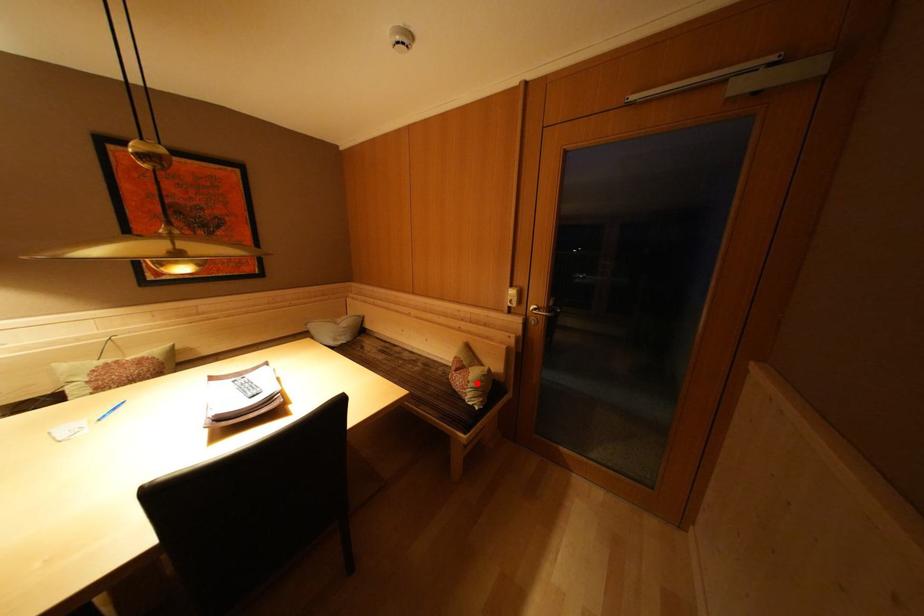
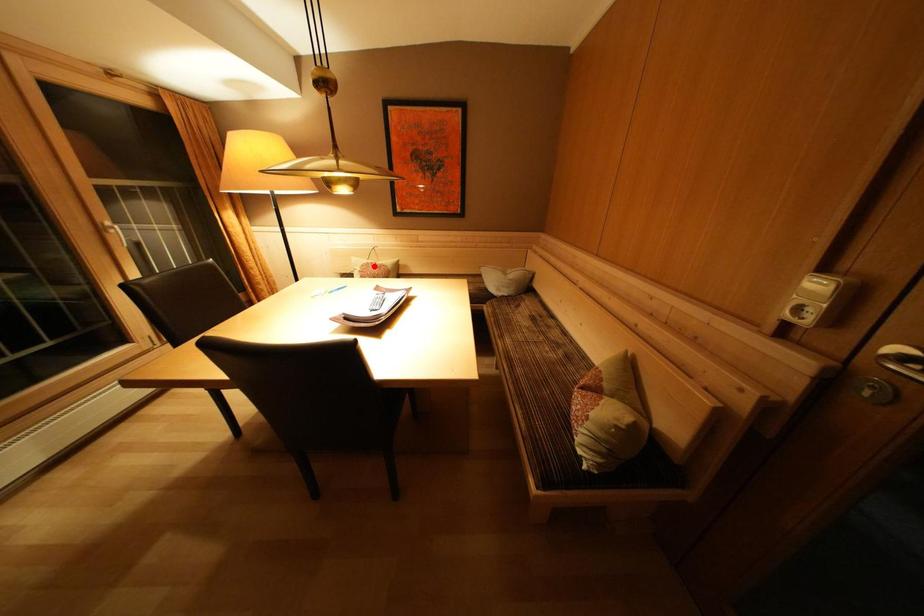
I am providing you with two images of the same scene from different viewpoints. A red point is marked on the first image and another point is marked on the second image. Are the points marked in image1 and image2 representing the same 3D position?

No